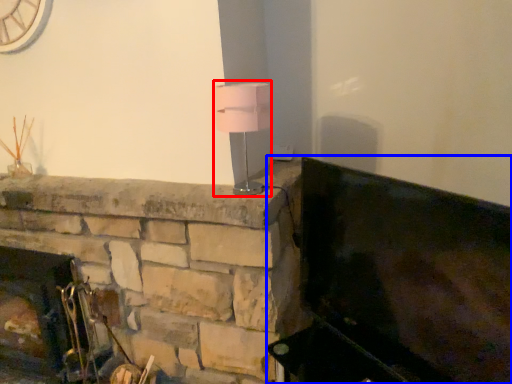
Question: Which object appears farthest to the camera in this image, table lamp (highlighted by a red box) or furniture (highlighted by a blue box)?

Choices:
 (A) table lamp
 (B) furniture

Answer: (A)